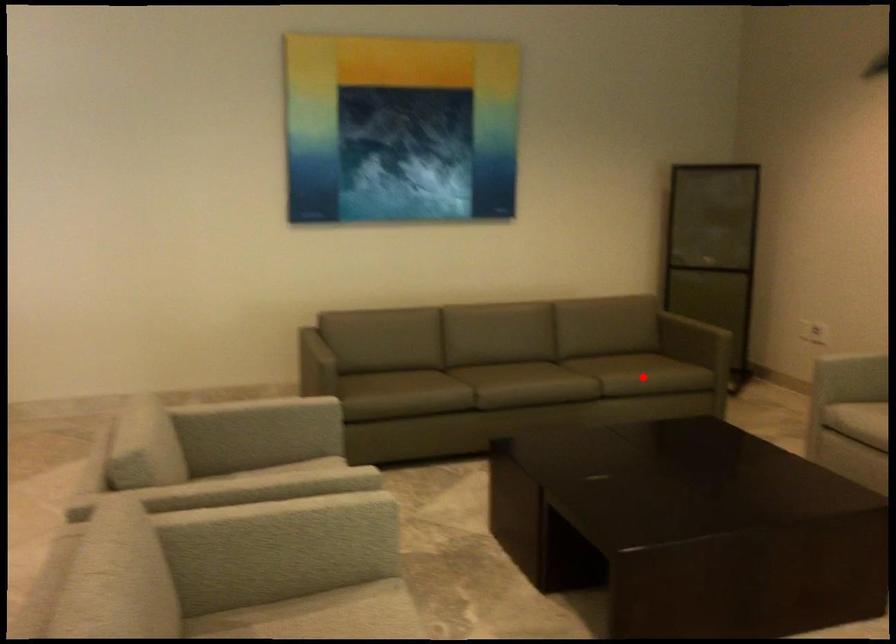
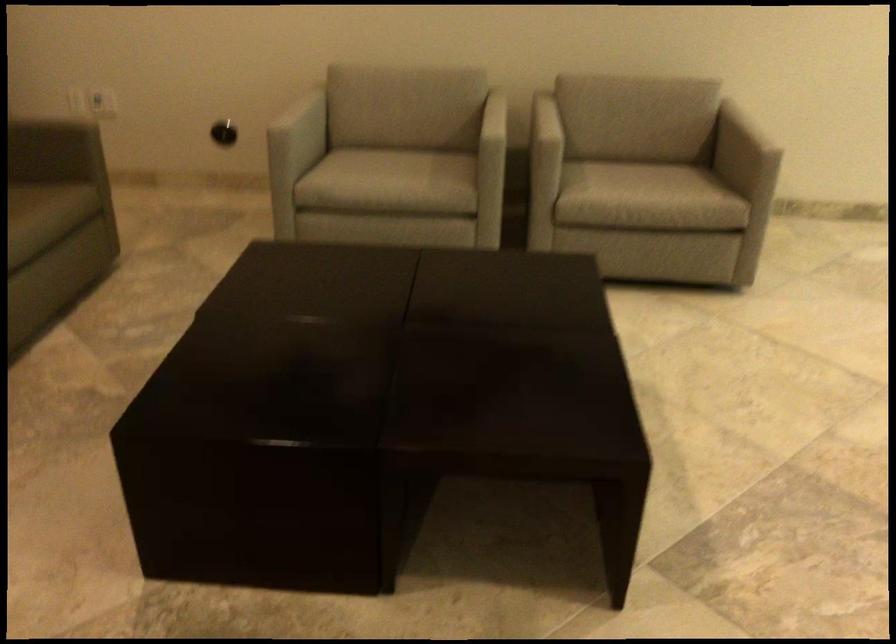
Question: A red point is marked in image1. In image2, is the corresponding 3D point closer to the camera or farther? Reply with the corresponding letter.

Choices:
 (A) The corresponding 3D point is closer.
 (B) The corresponding 3D point is farther.

Answer: (A)